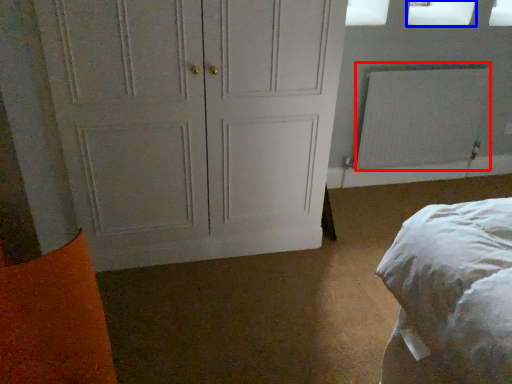
Question: Which point is closer to the camera, radiator (highlighted by a red box) or window screen (highlighted by a blue box)?

Choices:
 (A) radiator
 (B) window screen

Answer: (B)